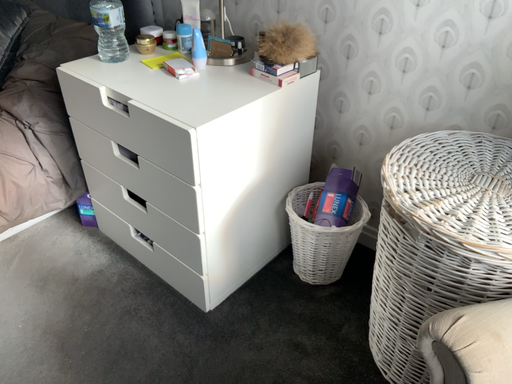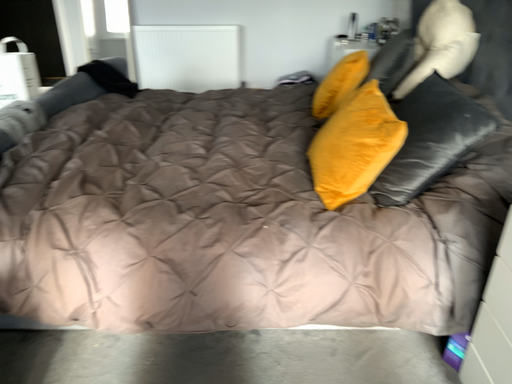
Question: How did the camera likely rotate when shooting the video?

Choices:
 (A) rotated left
 (B) rotated right

Answer: (A)